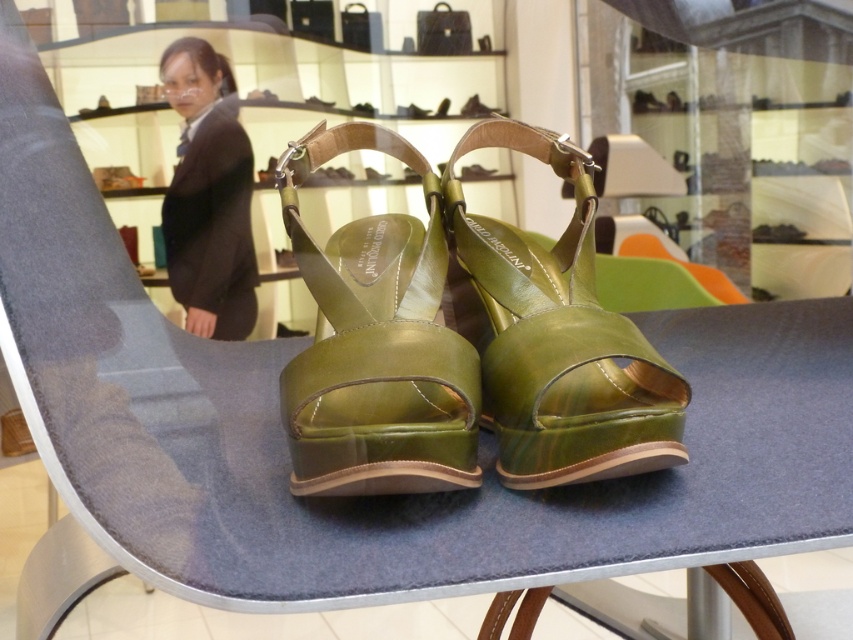
Does point (213, 67) lie behind point (473, 112)?

No, it is in front of (473, 112).

Between black fabric suit at upper left and metallic green sandal at center, which one appears on the right side from the viewer's perspective?

Positioned to the right is metallic green sandal at center.

Describe the element at coordinates (207, 196) in the screenshot. I see `black fabric suit at upper left` at that location.

Where is `black fabric suit at upper left`? The width and height of the screenshot is (853, 640). black fabric suit at upper left is located at coordinates (207, 196).

Can you confirm if green shiny leather sandals at center is positioned below metallic green sandal at center?

Yes, green shiny leather sandals at center is below metallic green sandal at center.

Who is taller, green shiny leather sandals at center or metallic green sandal at center?

Standing taller between the two is green shiny leather sandals at center.

Is point (346, 408) positioned after point (465, 113)?

That is False.

In order to click on green shiny leather sandals at center in this screenshot , I will do `click(376, 342)`.

Can you confirm if green leather sandal at center is positioned to the right of metallic green sandal at center?

Indeed, green leather sandal at center is positioned on the right side of metallic green sandal at center.

Can you confirm if green leather sandal at center is smaller than metallic green sandal at center?

Actually, green leather sandal at center might be larger than metallic green sandal at center.

Is point (567, 275) closer to camera compared to point (473, 97)?

Yes, it is in front of point (473, 97).

The image size is (853, 640). Find the location of `green leather sandal at center`. green leather sandal at center is located at coordinates (555, 336).